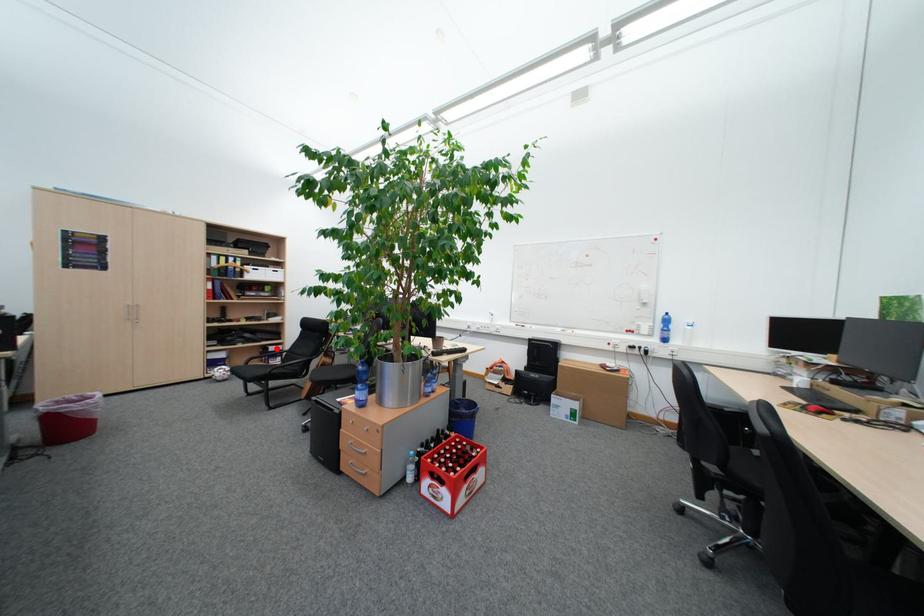
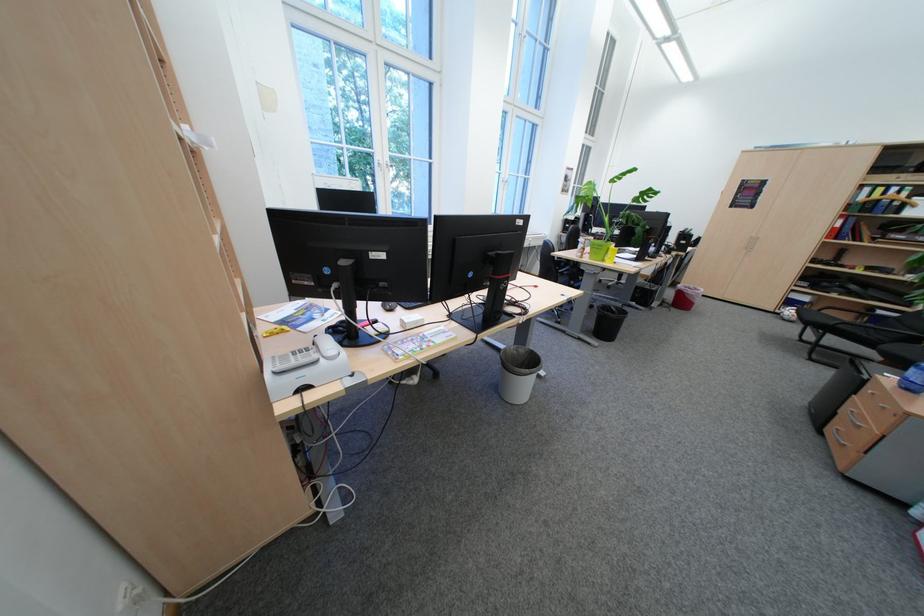
Question: I am providing you with two images of the same scene from different viewpoints. In image1, a red point is highlighted. Considering the same 3D point in image2, which of the following is correct?

Choices:
 (A) It is closer
 (B) It is farther

Answer: (B)